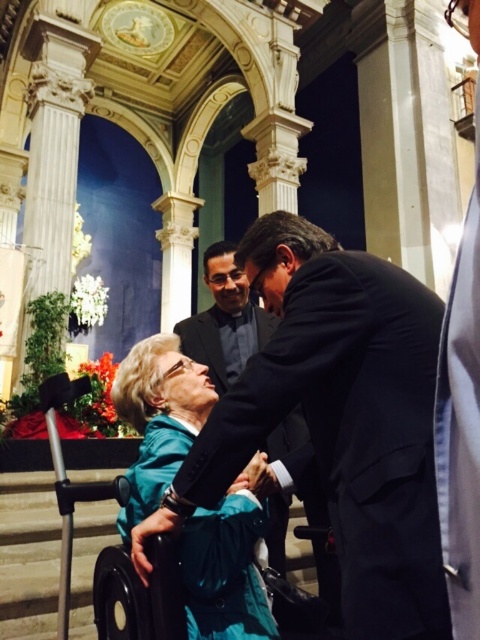
You are an event planner organizing a formal event at this venue. You need to place a decorative centerpiece between the black suit at center and the black satin suit at center. Where should you place it to ensure it is between them?

The black satin suit at center is behind the black suit at center, so you should place the decorative centerpiece in front of the black satin suit at center and behind the black suit at center to position it between them.

You are an event planner organizing a formal event in this venue. You need to ensure that the black satin suit at center is visible to all guests. Since the smooth skin hand at center is blocking part of it, how can you adjust the positioning of the hand to improve visibility?

The black satin suit at center is in front of the smooth skin hand at center, so moving the smooth skin hand at center behind the black satin suit at center would allow better visibility for all guests.